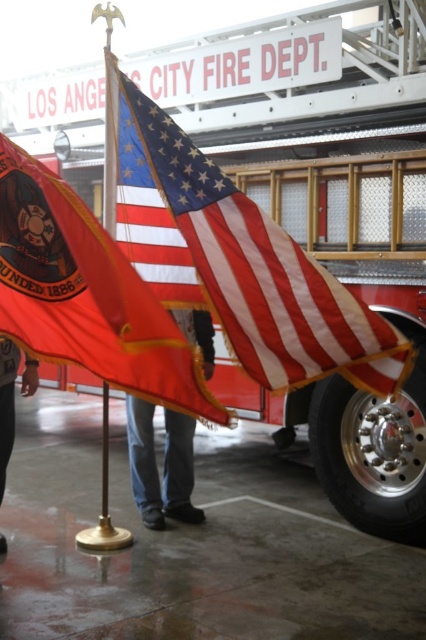
You are a visitor at the Los Angeles City Fire Department facility. You see the point marked at coordinates (x=86, y=294). What object is located at this point?

The point at coordinates (x=86, y=294) corresponds to the matte red flag at center.

You are a firefighter who just finished a shift and wants to hang your jeans at center on a hook that is exactly 1.6 meters away from the american flag at center. Can you hang your jeans there?

The distance between the american flag at center and jeans at center is 1.72 meters, which is greater than 1.6 meters. Therefore, the hook is not within the required distance to hang the jeans there.